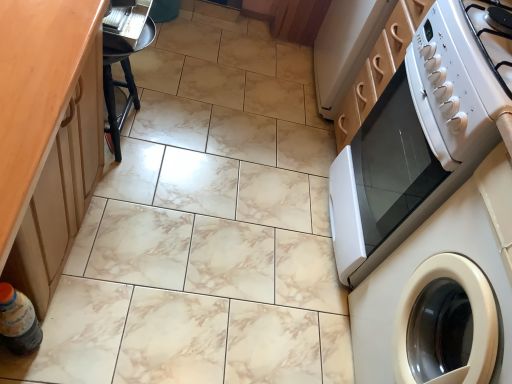
The image size is (512, 384). What do you see at coordinates (423, 133) in the screenshot? I see `white glossy microwave at right` at bounding box center [423, 133].

What is the approximate width of black wood bar stool at left?

It is 8.32 inches.

Image resolution: width=512 pixels, height=384 pixels. Identify the location of white glossy washing machine at right. (435, 254).

The image size is (512, 384). I want to click on dark brown plastic bottle at lower left, so click(x=18, y=321).

I want to click on white glossy electric stove at upper right, so click(x=456, y=85).

Are white glossy microwave at right and black wood bar stool at left far apart?

They are positioned close to each other.

Is white glossy microwave at right surrounding black wood bar stool at left?

No, black wood bar stool at left is located outside of white glossy microwave at right.

Looking at the image, does white glossy microwave at right seem bigger or smaller compared to black wood bar stool at left?

white glossy microwave at right is bigger than black wood bar stool at left.

In the image, is white glossy microwave at right on the left side or the right side of black wood bar stool at left?

From the image, it's evident that white glossy microwave at right is to the right of black wood bar stool at left.

Based on the photo, from the image's perspective, is dark brown plastic bottle at lower left on top of white glossy washing machine at right?

Yes, from the image's perspective, dark brown plastic bottle at lower left is on top of white glossy washing machine at right.

In the image, is dark brown plastic bottle at lower left positioned in front of or behind white glossy washing machine at right?

Visually, dark brown plastic bottle at lower left is located behind white glossy washing machine at right.

Image resolution: width=512 pixels, height=384 pixels. Identify the location of washing machine below the dark brown plastic bottle at lower left (from the image's perspective). (435, 254).

Are white glossy washing machine at right and white glossy electric stove at upper right located far from each other?

No.

Is white glossy washing machine at right completely or partially outside of white glossy electric stove at upper right?

Yes, white glossy washing machine at right is located beyond the bounds of white glossy electric stove at upper right.

Is white glossy washing machine at right smaller than white glossy electric stove at upper right?

No.

From the image's perspective, relative to white glossy electric stove at upper right, is white glossy washing machine at right above or below?

white glossy washing machine at right is situated lower than white glossy electric stove at upper right in the image.

Based on their positions, is white glossy electric stove at upper right located to the left or right of black wood bar stool at left?

In the image, white glossy electric stove at upper right appears on the right side of black wood bar stool at left.

Based on the photo, from their relative heights in the image, would you say white glossy electric stove at upper right is taller or shorter than black wood bar stool at left?

white glossy electric stove at upper right is shorter than black wood bar stool at left.

In the scene shown: From the image's perspective, does white glossy electric stove at upper right appear higher than black wood bar stool at left?

Actually, white glossy electric stove at upper right appears below black wood bar stool at left in the image.

Is black wood bar stool at left at the back of white glossy electric stove at upper right?

white glossy electric stove at upper right is not turned away from black wood bar stool at left.

From a real-world perspective, which is physically above, black wood bar stool at left or dark brown plastic bottle at lower left?

black wood bar stool at left is physically above.

Considering the sizes of objects black wood bar stool at left and dark brown plastic bottle at lower left in the image provided, who is taller, black wood bar stool at left or dark brown plastic bottle at lower left?

Standing taller between the two is black wood bar stool at left.

Find the location of a particular element. This screenshot has height=384, width=512. bar stool above the dark brown plastic bottle at lower left (from a real-world perspective) is located at coordinates (122, 86).

Between black wood bar stool at left and dark brown plastic bottle at lower left, which one has larger size?

With larger size is black wood bar stool at left.

Where is `washing machine above the black wood bar stool at left (from a real-world perspective)`? The image size is (512, 384). washing machine above the black wood bar stool at left (from a real-world perspective) is located at coordinates (435, 254).

Would you say white glossy washing machine at right is part of black wood bar stool at left's contents?

No, white glossy washing machine at right is not inside black wood bar stool at left.

Does black wood bar stool at left come in front of white glossy washing machine at right?

That is False.

In the scene shown: Would you consider black wood bar stool at left to be distant from white glossy washing machine at right?

Yes, black wood bar stool at left is far from white glossy washing machine at right.

Looking at this image, choose the correct answer: Is white glossy electric stove at upper right inside white glossy microwave at right or outside it?

white glossy electric stove at upper right is located beyond the bounds of white glossy microwave at right.

From the picture: Considering the relative sizes of white glossy electric stove at upper right and white glossy microwave at right in the image provided, is white glossy electric stove at upper right taller than white glossy microwave at right?

No, white glossy electric stove at upper right is not taller than white glossy microwave at right.

Does white glossy electric stove at upper right touch white glossy microwave at right?

No, white glossy electric stove at upper right is not touching white glossy microwave at right.

From a real-world perspective, which is physically below, white glossy electric stove at upper right or white glossy microwave at right?

From a 3D spatial view, white glossy microwave at right is below.

This screenshot has width=512, height=384. Find the location of `bar stool below the white glossy microwave at right (from a real-world perspective)`. bar stool below the white glossy microwave at right (from a real-world perspective) is located at coordinates (122, 86).

Find the location of a particular element. This screenshot has width=512, height=384. bottle above the white glossy washing machine at right (from the image's perspective) is located at coordinates 18,321.

Based on the photo, considering their positions, is white glossy electric stove at upper right positioned further to dark brown plastic bottle at lower left than white glossy washing machine at right?

white glossy electric stove at upper right.

From the image, which object appears to be farther from white glossy electric stove at upper right, white glossy microwave at right or white glossy washing machine at right?

white glossy washing machine at right is positioned further to the anchor white glossy electric stove at upper right.

Estimate the real-world distances between objects in this image. Which object is closer to white glossy microwave at right, dark brown plastic bottle at lower left or white glossy washing machine at right?

Based on the image, white glossy washing machine at right appears to be nearer to white glossy microwave at right.

Which object lies nearer to the anchor point black wood bar stool at left, dark brown plastic bottle at lower left or white glossy washing machine at right?

dark brown plastic bottle at lower left.

When comparing their distances from white glossy washing machine at right, does black wood bar stool at left or white glossy microwave at right seem further?

black wood bar stool at left is further to white glossy washing machine at right.

When comparing their distances from white glossy microwave at right, does white glossy washing machine at right or black wood bar stool at left seem further?

black wood bar stool at left is further to white glossy microwave at right.

Which object lies further to the anchor point white glossy washing machine at right, white glossy microwave at right or black wood bar stool at left?

Among the two, black wood bar stool at left is located further to white glossy washing machine at right.

Estimate the real-world distances between objects in this image. Which object is further from dark brown plastic bottle at lower left, black wood bar stool at left or white glossy electric stove at upper right?

white glossy electric stove at upper right is positioned further to the anchor dark brown plastic bottle at lower left.

Locate an element on the screen. This screenshot has height=384, width=512. home appliance between black wood bar stool at left and white glossy washing machine at right from left to right is located at coordinates (423, 133).

I want to click on home appliance between dark brown plastic bottle at lower left and white glossy washing machine at right, so click(423, 133).

Where is `home appliance between white glossy electric stove at upper right and white glossy washing machine at right in the vertical direction`? home appliance between white glossy electric stove at upper right and white glossy washing machine at right in the vertical direction is located at coordinates (423, 133).

Find the location of a particular element. bar stool between dark brown plastic bottle at lower left and white glossy washing machine at right is located at coordinates (122, 86).